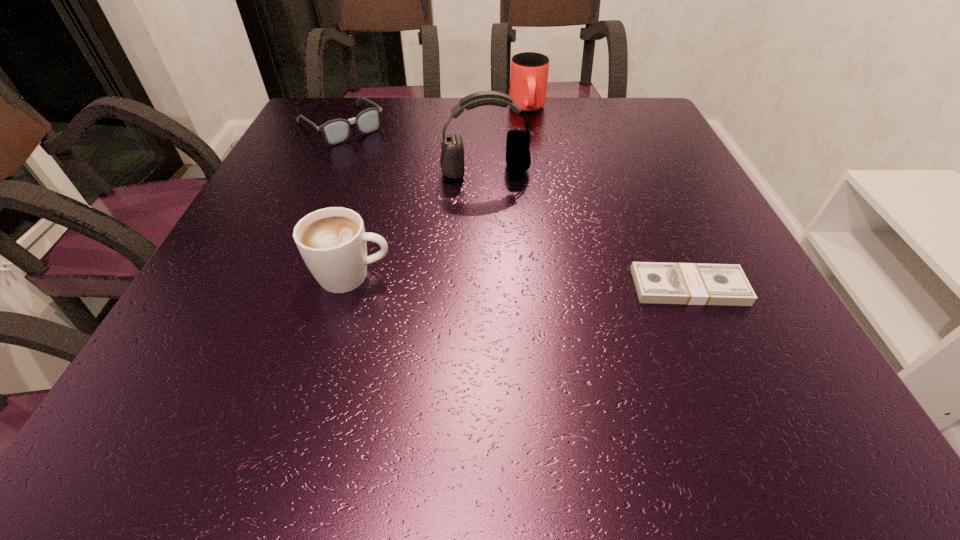
Locate an element on the screen. object present at the left edge is located at coordinates (335, 131).

What are the coordinates of `object that is at the right edge` in the screenshot? It's located at (657, 283).

At what (x,y) coordinates should I click in order to perform the action: click on object located in the far left corner section of the desktop. Please return your answer as a coordinate pair (x, y). Looking at the image, I should click on (335, 131).

Image resolution: width=960 pixels, height=540 pixels. In the image, there is a desktop. Find the location of `free space at the far edge`. free space at the far edge is located at coordinates (564, 116).

In the image, there is a desktop. At what (x,y) coordinates should I click in order to perform the action: click on vacant space at the left edge. Please return your answer as a coordinate pair (x, y). Image resolution: width=960 pixels, height=540 pixels. Looking at the image, I should click on (217, 266).

The image size is (960, 540). In the image, there is a desktop. Identify the location of vacant space at the right edge. (668, 171).

The width and height of the screenshot is (960, 540). In the image, there is a desktop. Find the location of `vacant space at the far left corner`. vacant space at the far left corner is located at coordinates (337, 111).

Where is `vacant region at the far right corner of the desktop`? vacant region at the far right corner of the desktop is located at coordinates (636, 99).

The width and height of the screenshot is (960, 540). I want to click on vacant point located between the third nearest object and the cappuccino, so click(420, 224).

Find the location of `free space that is in between the spectacles and the rightmost object`. free space that is in between the spectacles and the rightmost object is located at coordinates (515, 206).